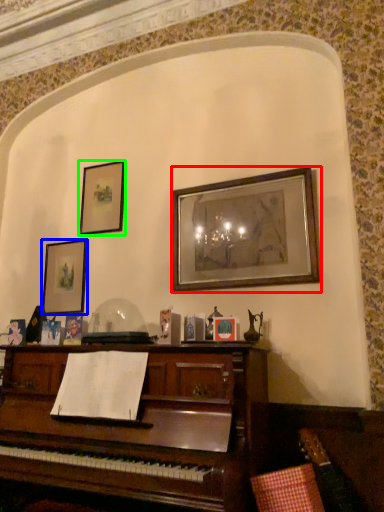
Question: Which is nearer to the picture frame (highlighted by a red box)? picture frame (highlighted by a blue box) or picture frame (highlighted by a green box).

Choices:
 (A) picture frame
 (B) picture frame

Answer: (B)